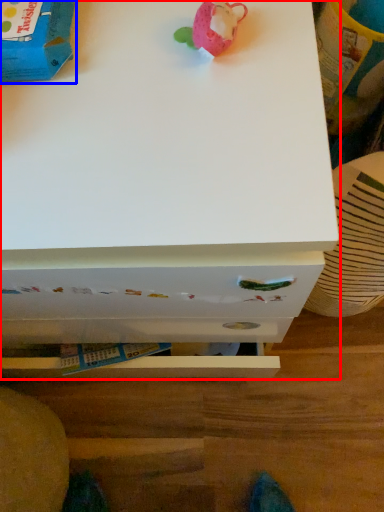
Question: Among these objects, which one is nearest to the camera, chest of drawers (highlighted by a red box) or toy (highlighted by a blue box)?

Choices:
 (A) chest of drawers
 (B) toy

Answer: (A)